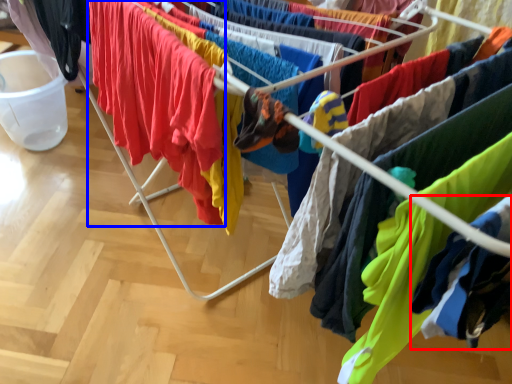
Question: Among these objects, which one is farthest to the camera, clothing (highlighted by a red box) or clothing (highlighted by a blue box)?

Choices:
 (A) clothing
 (B) clothing

Answer: (B)